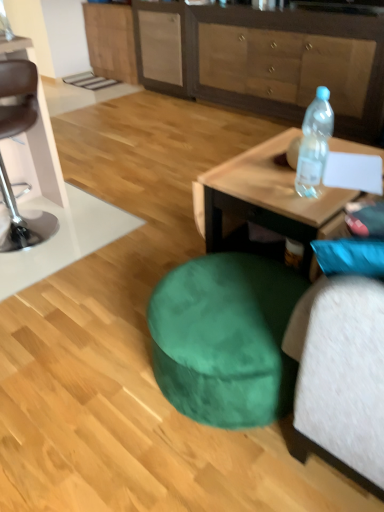
Image resolution: width=384 pixels, height=512 pixels. Identify the location of blank space situated above velvet green bean bag at lower center (from a real-world perspective). (222, 301).